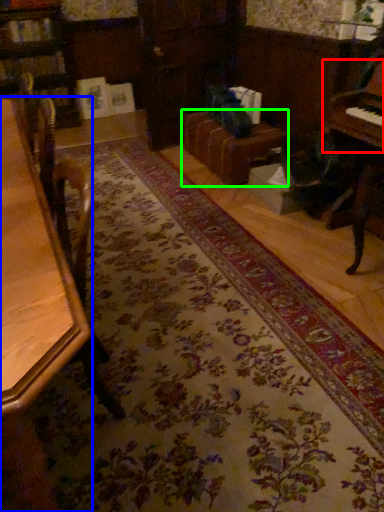
Question: Based on their relative distances, which object is farther from piano (highlighted by a red box)? Choose from table (highlighted by a blue box) and couch (highlighted by a green box).

Choices:
 (A) table
 (B) couch

Answer: (A)